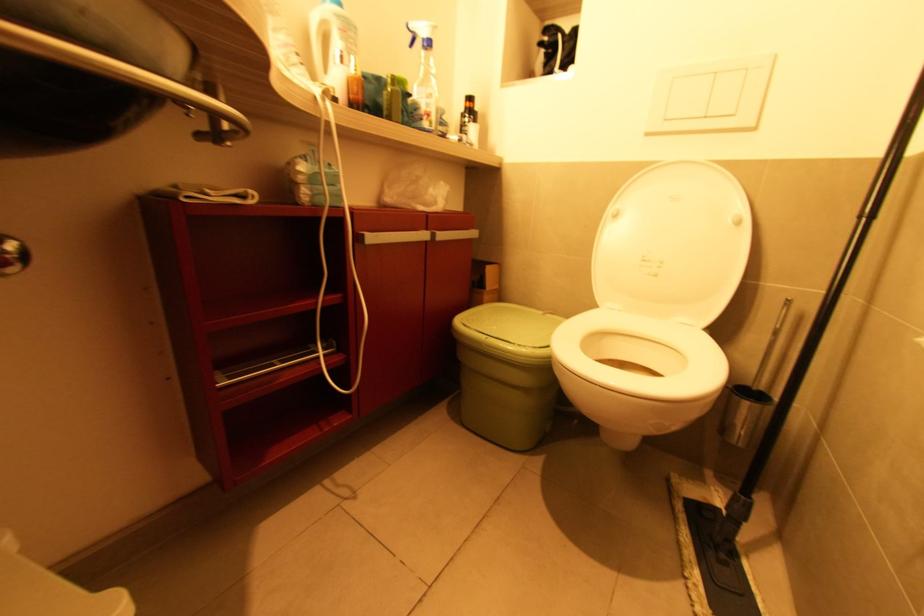
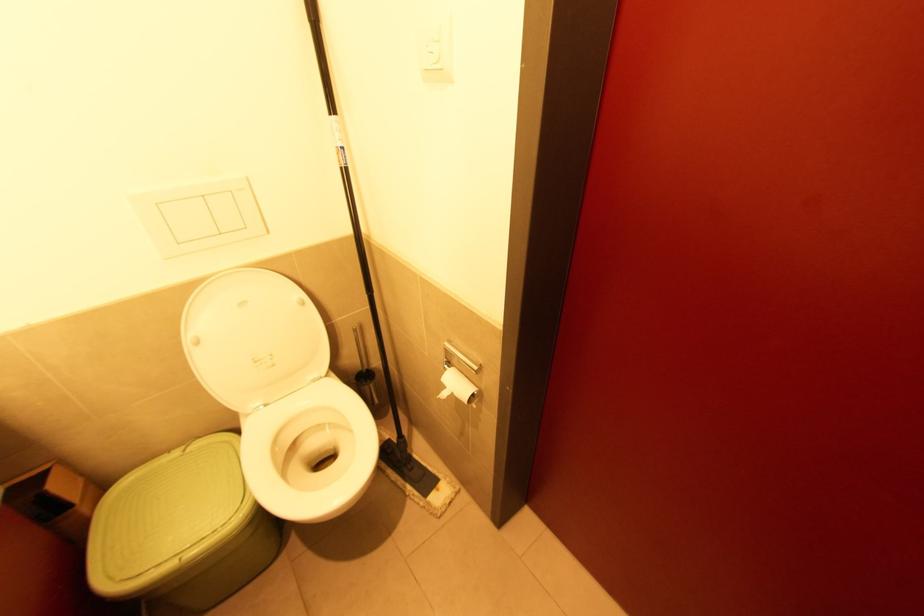
Locate, in the second image, the point that corresponds to (709,118) in the first image.

(224, 235)